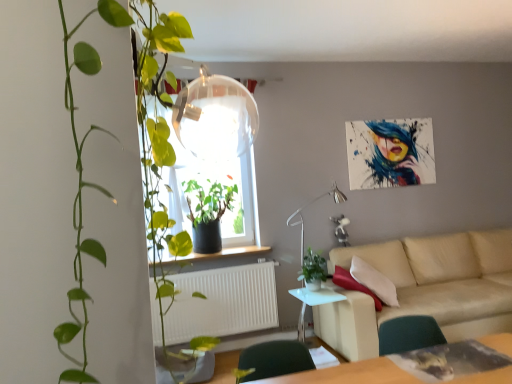
Image resolution: width=512 pixels, height=384 pixels. In order to click on vacant space underneath green matte plant at center, acting as the second houseplant starting from the front (from a real-world perspective) in this screenshot , I will do `click(318, 291)`.